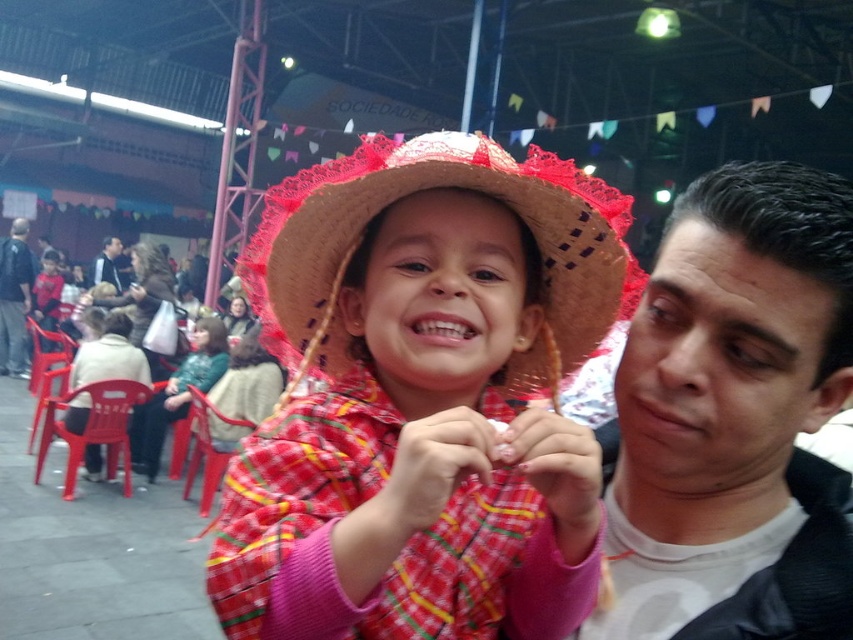
Question: Which is farther from the dark blue jeans at left?

Choices:
 (A) straw hat at center
 (B) smooth black jacket at right

Answer: (B)

Question: Is smooth black jacket at right to the right of dark blue jeans at left from the viewer's perspective?

Choices:
 (A) no
 (B) yes

Answer: (B)

Question: Among these points, which one is farthest from the camera?

Choices:
 (A) (109, 246)
 (B) (9, 323)
 (C) (793, 540)
 (D) (614, 305)

Answer: (A)

Question: Does smooth black jacket at right appear on the left side of dark blue jeans at left?

Choices:
 (A) no
 (B) yes

Answer: (A)

Question: Which of the following is the closest to the observer?

Choices:
 (A) straw hat at center
 (B) dark gray fabric jacket at upper center
 (C) smooth black jacket at right

Answer: (C)

Question: Does straw hat at center have a smaller size compared to dark gray fabric jacket at upper center?

Choices:
 (A) no
 (B) yes

Answer: (B)